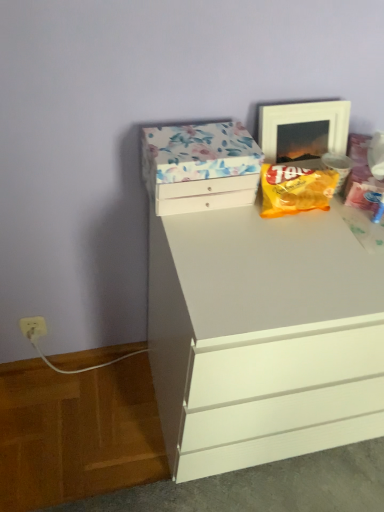
Question: From a real-world perspective, is white plastic electric outlet at lower left above or below floral paper-covered box at upper center?

Choices:
 (A) below
 (B) above

Answer: (A)

Question: Is white plastic electric outlet at lower left spatially inside floral paper-covered box at upper center, or outside of it?

Choices:
 (A) inside
 (B) outside

Answer: (B)

Question: Which is nearer to the white glossy picture frame at upper right?

Choices:
 (A) white matte chest of drawers at center
 (B) floral paper-covered box at upper center
 (C) white plastic electric outlet at lower left
 (D) yellow matte snack packet at upper right

Answer: (D)

Question: Based on their relative distances, which object is nearer to the white glossy picture frame at upper right?

Choices:
 (A) white plastic electric outlet at lower left
 (B) white matte chest of drawers at center
 (C) yellow matte snack packet at upper right
 (D) floral paper-covered box at upper center

Answer: (C)